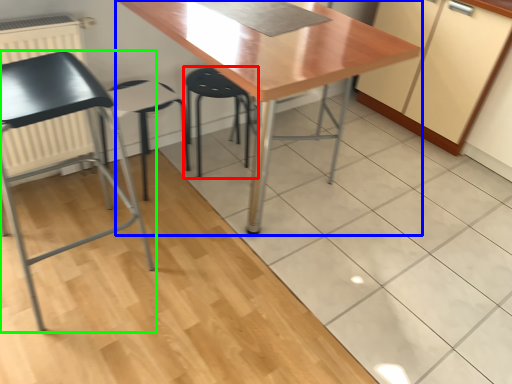
Question: Based on their relative distances, which object is nearer to step stool (highlighted by a red box)? Choose from table (highlighted by a blue box) and chair (highlighted by a green box).

Choices:
 (A) table
 (B) chair

Answer: (B)